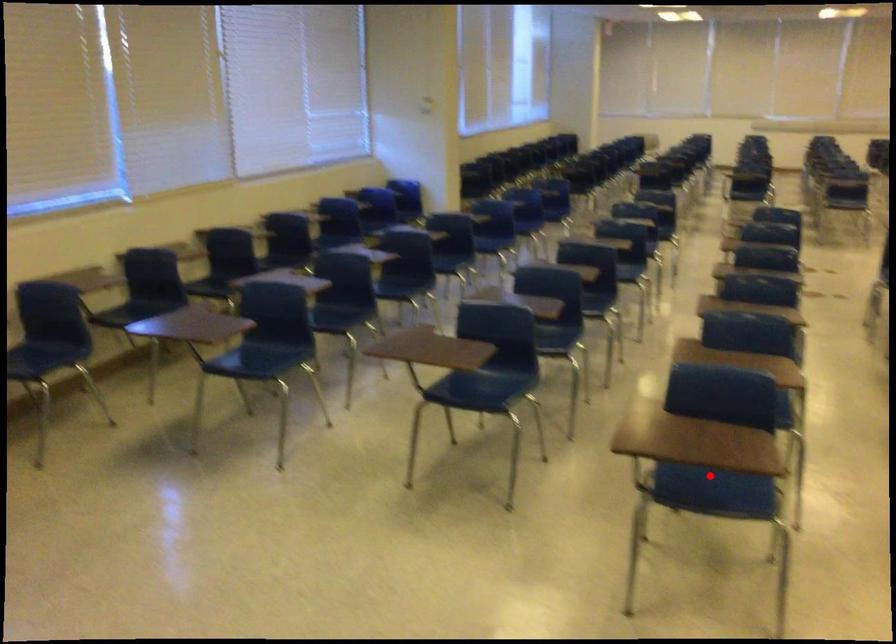
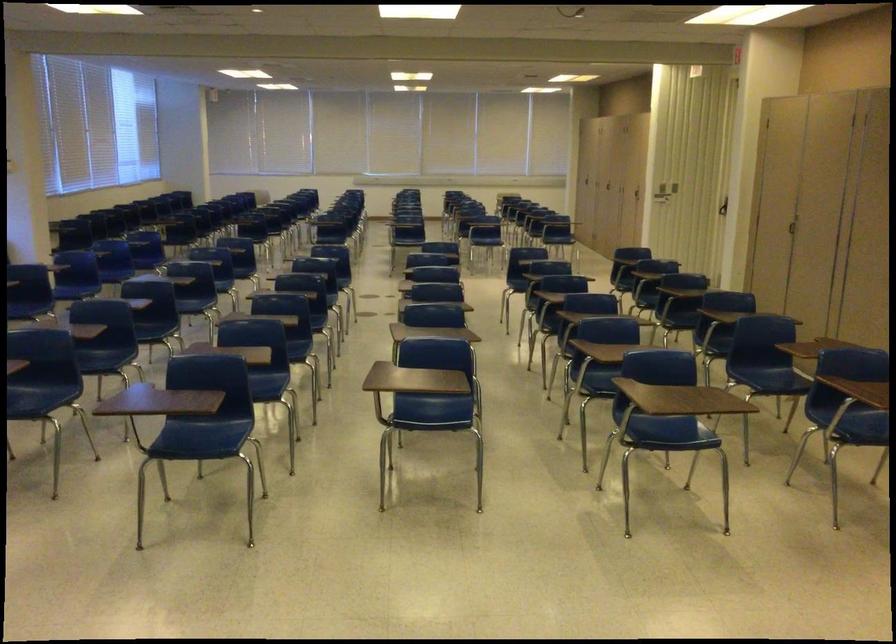
In the second image, find the point that corresponds to the highlighted location in the first image.

(203, 436)